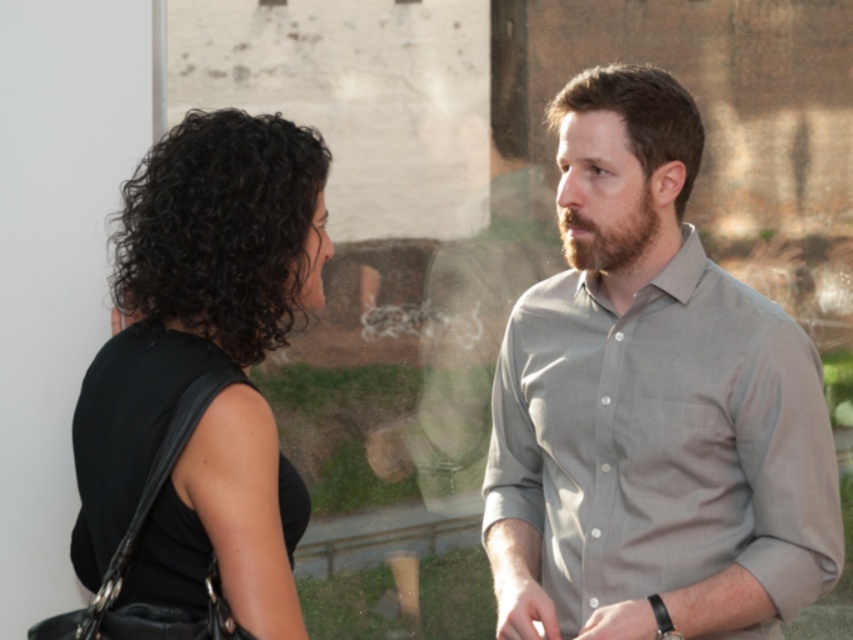
You are a photographer trying to capture a candid shot of the two people near the glass barrier. You want to ensure the gray cotton shirt at right and the brownwoollybeard at right are both visible in the frame. Based on their positions, which object should you focus on first to include both in the shot?

The gray cotton shirt at right is located below brownwoollybeard at right, so focusing on the brownwoollybeard at right first will ensure both are in the frame as the shirt is positioned lower.

You are a photographer trying to capture a candid shot of the two people talking near the glass barrier. The black matte dress at left is located at point (193, 292). Where should you position your camera to ensure the black matte dress at left and the man in light gray button up shirt are both clearly visible in the frame?

To capture both the black matte dress at left and the man in light gray button up shirt clearly, position the camera so it faces the center between their positions. Since the black matte dress at left is at point (193, 292), align the camera to include both subjects within the frame, ensuring neither is cropped out.

You are a photographer trying to capture a candid shot of the two people talking near the glass barrier. You want to ensure both the gray cotton shirt at right and the brownwoollybeard at right are clearly visible in the photo. Given that your camera has a minimum focus distance of 12 inches, will you be able to focus on both subjects simultaneously?

The gray cotton shirt at right and the brownwoollybeard at right are 12.14 inches apart from each other. Since the distance between them is slightly more than the camera minimum focus distance of 12 inches, the camera can focus on both subjects simultaneously.